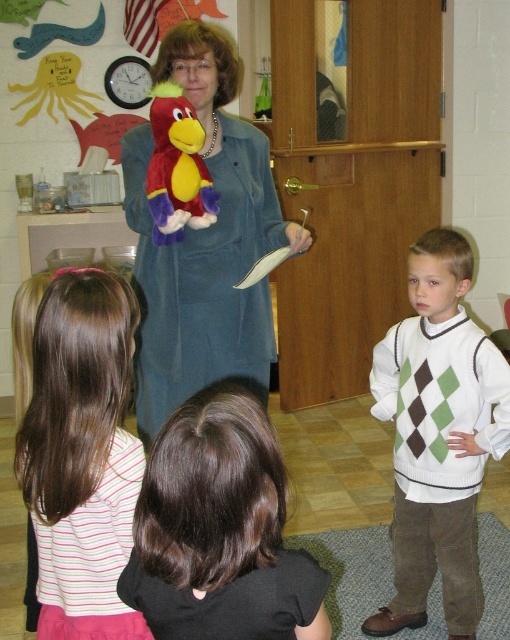
Question: Can you confirm if velvety blue coat at center is positioned above velvet plush parrot at center?

Choices:
 (A) no
 (B) yes

Answer: (A)

Question: Is the position of green argyle sweater at right more distant than that of velvet plush parrot at center?

Choices:
 (A) yes
 (B) no

Answer: (A)

Question: Can you confirm if velvety blue coat at center is positioned above velvet plush parrot at center?

Choices:
 (A) no
 (B) yes

Answer: (A)

Question: Which point appears closest to the camera in this image?

Choices:
 (A) (190, 26)
 (B) (173, 86)

Answer: (B)

Question: Among these objects, which one is nearest to the camera?

Choices:
 (A) green argyle sweater at right
 (B) velvety blue coat at center

Answer: (B)

Question: Which point is closer to the camera?

Choices:
 (A) velvet plush parrot at center
 (B) velvety blue coat at center

Answer: (A)